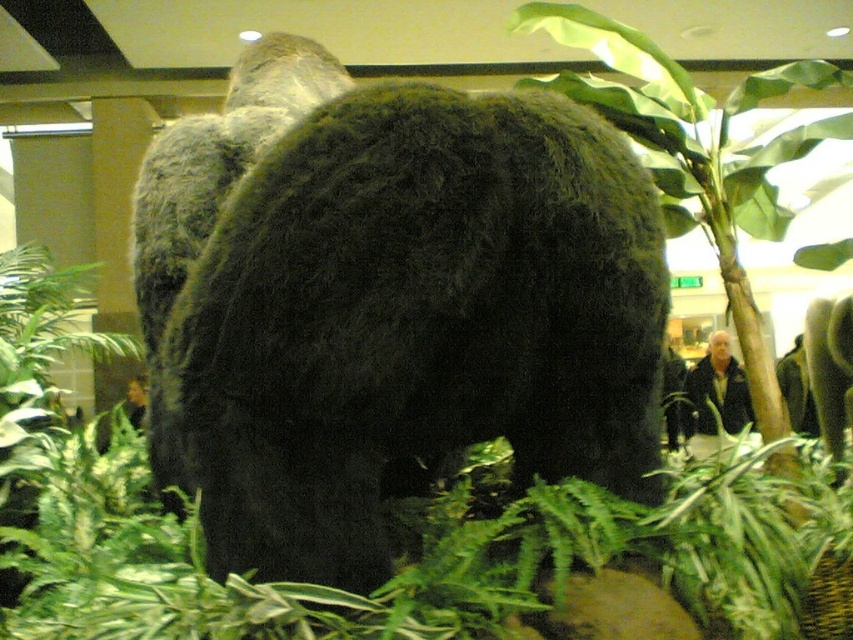
You are standing in front of the gorilla statue and want to touch the point at coordinates point (x=502, y=200). If your arm can reach 2 meters, can you reach it?

The point (x=502, y=200) is 2.13 meters away from viewer, so you cannot reach it with an arm that can only reach 2 meters.

You are standing in front of the gorilla statue and notice a black fuzzy bear at center and a green leafy fern at center. Which object is positioned to the left?

The black fuzzy bear at center is to the left of the green leafy fern at center.

You are an interior designer planning to place a new plant in this space. You have a tall palm tree that is 1.8 meters in height. The black fuzzy bear at center and the green leafy fern at center are already present. Considering their current heights, will the palm tree be taller than both?

The black fuzzy bear at center has a lesser height compared to green leafy fern at center. Since the palm tree is 1.8 meters tall, it would likely be taller than both the black fuzzy bear at center and the green leafy fern at center unless the fern exceeds 1.8 meters, which isn